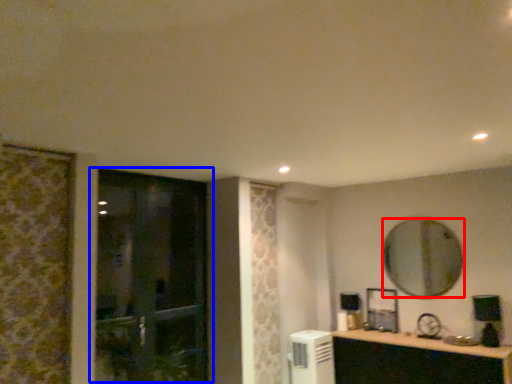
Question: Which point is closer to the camera, mirror (highlighted by a red box) or door (highlighted by a blue box)?

Choices:
 (A) mirror
 (B) door

Answer: (B)